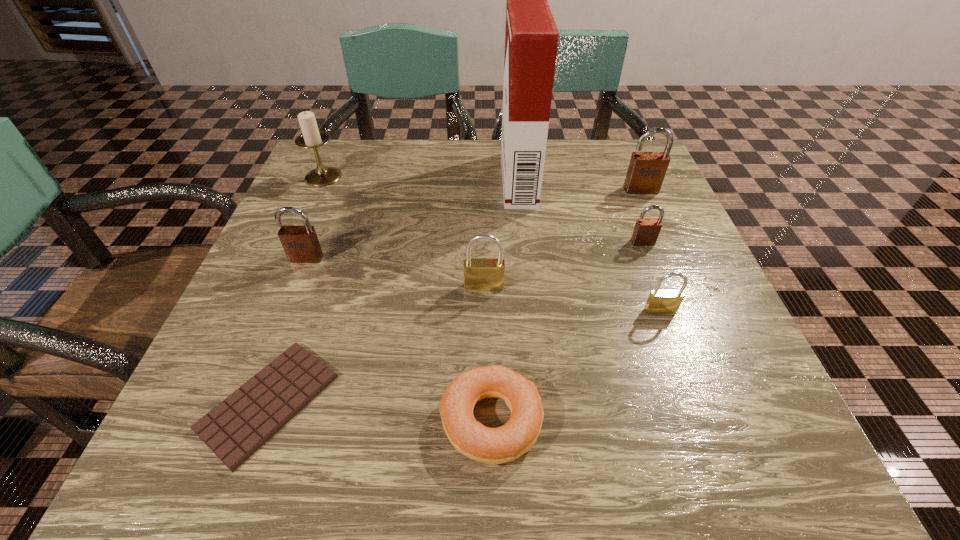
Identify the location of free spot located 0.120m on the right of the candle holder. (393, 177).

The width and height of the screenshot is (960, 540). In order to click on free space located on the front-facing side of the farthest brown padlock in this screenshot , I will do `click(706, 338)`.

Where is `vacant area located on the front-facing side of the leftmost padlock`? Image resolution: width=960 pixels, height=540 pixels. vacant area located on the front-facing side of the leftmost padlock is located at coordinates (243, 420).

In order to click on blank area located 0.230m on the front-facing side of the bigger brass padlock in this screenshot , I will do `click(485, 413)`.

Identify the location of vacant space located on the front-facing side of the nearer brass padlock. This screenshot has width=960, height=540. (701, 422).

Identify the location of free space located 0.230m on the front-facing side of the smallest brown padlock. (682, 343).

Locate an element on the screen. This screenshot has height=540, width=960. free point located on the right of the eighth tallest object is located at coordinates (578, 420).

Where is `free spot located on the right of the chocolate bar`? The height and width of the screenshot is (540, 960). free spot located on the right of the chocolate bar is located at coordinates (487, 402).

Locate an element on the screen. This screenshot has height=540, width=960. cigarette_case at the far edge is located at coordinates (531, 38).

Where is `candle holder that is at the far edge`? candle holder that is at the far edge is located at coordinates (311, 137).